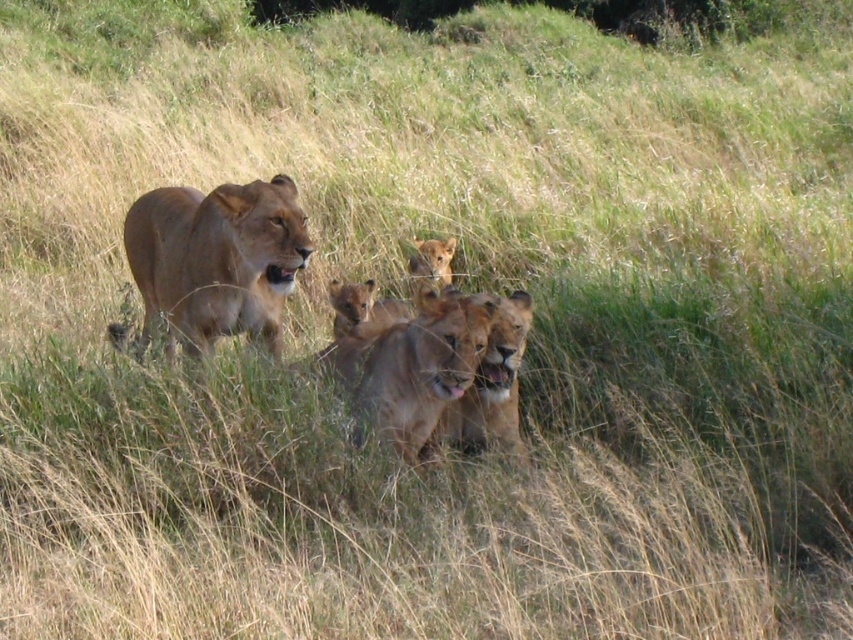
Question: Which point is closer to the camera?

Choices:
 (A) golden fur lioness at center
 (B) golden fur cub at center

Answer: (A)

Question: Among these points, which one is nearest to the camera?

Choices:
 (A) (434, 250)
 (B) (178, 317)

Answer: (B)

Question: Which object is farther from the camera taking this photo?

Choices:
 (A) golden fur cub at center
 (B) golden fur lioness at center

Answer: (A)

Question: Is golden fur lioness at center bigger than golden fur cub at center?

Choices:
 (A) no
 (B) yes

Answer: (B)

Question: Is golden fur lioness at center bigger than golden fur cub at center?

Choices:
 (A) no
 (B) yes

Answer: (B)

Question: Is golden fur lioness at center thinner than golden fur cub at center?

Choices:
 (A) yes
 (B) no

Answer: (B)